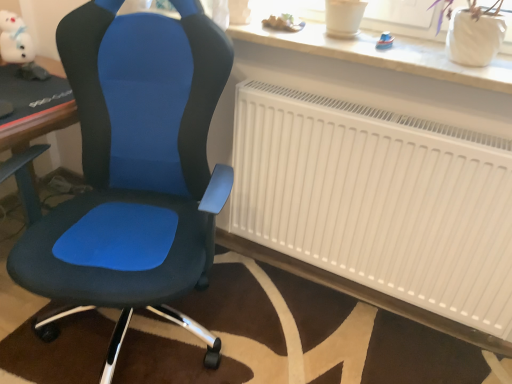
Question: From the image's perspective, is white plush toy at upper left, the first toy positioned from the left, on top of white matte radiator at center?

Choices:
 (A) yes
 (B) no

Answer: (A)

Question: Is white plush toy at upper left, the first toy positioned from the back, at the left side of white matte radiator at center?

Choices:
 (A) yes
 (B) no

Answer: (A)

Question: From a real-world perspective, is white plush toy at upper left, the third toy positioned from the right, on white matte radiator at center?

Choices:
 (A) no
 (B) yes

Answer: (B)

Question: From a real-world perspective, is white plush toy at upper left, the third toy positioned from the right, positioned under white matte radiator at center based on gravity?

Choices:
 (A) no
 (B) yes

Answer: (A)

Question: Is white plush toy at upper left, the first toy positioned from the left, looking in the opposite direction of white matte radiator at center?

Choices:
 (A) no
 (B) yes

Answer: (A)

Question: Can you confirm if white plush toy at upper left, the third toy positioned from the right, is smaller than white matte radiator at center?

Choices:
 (A) no
 (B) yes

Answer: (B)

Question: Can you confirm if matte blue fabric chair at center is bigger than wooden toy boat at upper center, placed as the second toy when sorted from right to left?

Choices:
 (A) no
 (B) yes

Answer: (B)

Question: Can you confirm if matte blue fabric chair at center is positioned to the left of wooden toy boat at upper center, placed as the second toy when sorted from right to left?

Choices:
 (A) yes
 (B) no

Answer: (A)

Question: Does matte blue fabric chair at center have a lesser width compared to wooden toy boat at upper center, the second toy positioned from the left?

Choices:
 (A) no
 (B) yes

Answer: (A)

Question: Does matte blue fabric chair at center have a greater width compared to wooden toy boat at upper center, which ranks as the second toy in back-to-front order?

Choices:
 (A) yes
 (B) no

Answer: (A)

Question: Could you tell me if matte blue fabric chair at center is facing wooden toy boat at upper center, which ranks as the second toy in front-to-back order?

Choices:
 (A) yes
 (B) no

Answer: (B)

Question: Is matte blue fabric chair at center positioned behind wooden toy boat at upper center, which ranks as the second toy in back-to-front order?

Choices:
 (A) no
 (B) yes

Answer: (A)

Question: Is wooden toy boat at upper center, the second toy positioned from the left, further to the viewer compared to white matte radiator at center?

Choices:
 (A) yes
 (B) no

Answer: (A)